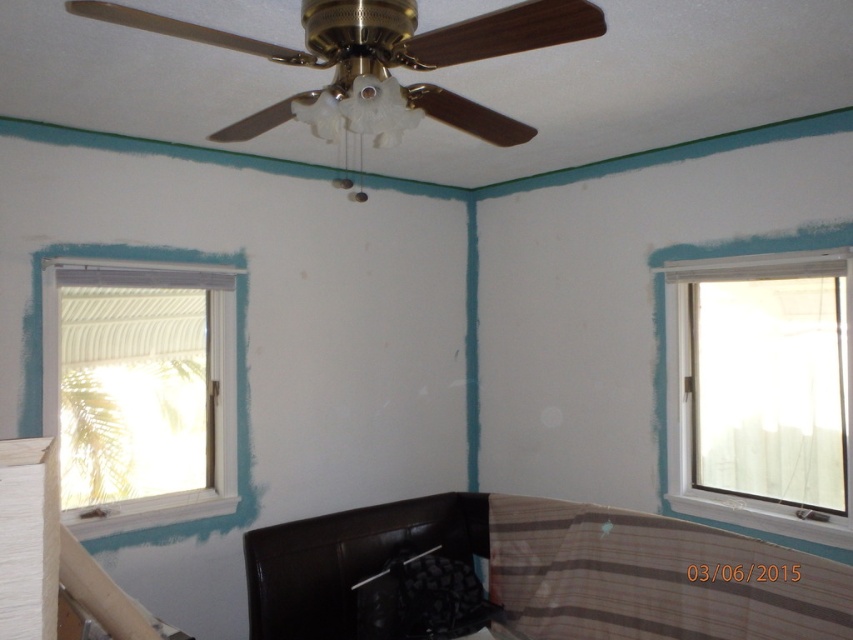
You are standing in the room and want to move from the point at coordinates point (68, 509) to the point at coordinates point (730, 262). Which direction should you move relative to the ceiling fan?

You should move towards the ceiling fan because point (68, 509) is in front of point (730, 262), meaning the latter is behind the former relative to the fan.

You are a painter working in this room and need to check the windows. Which window is located to the left of the other one? The white painted wood window at left or the white plastic window at upper right?

The white painted wood window at left is positioned on the left side of white plastic window at upper right.